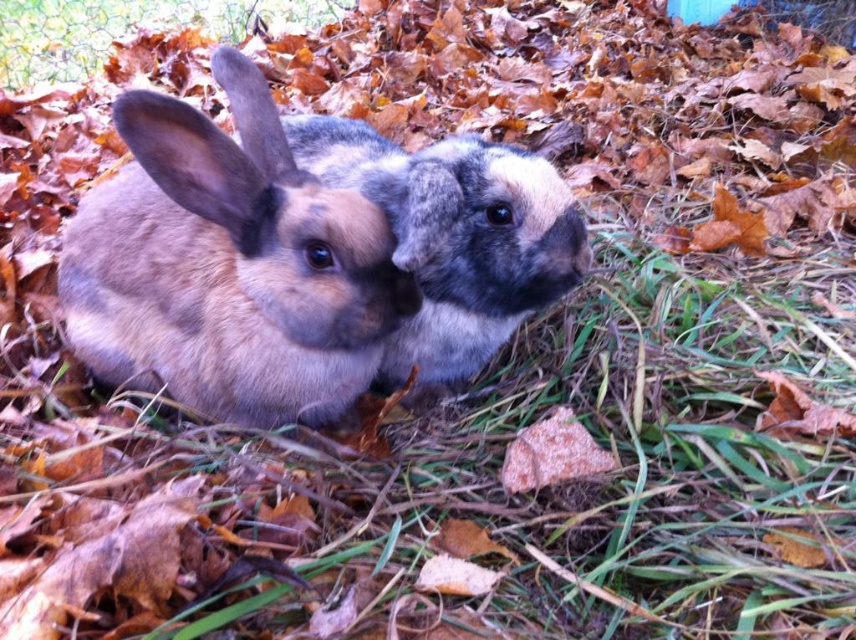
Question: Is fuzzy brown rabbit at left smaller than green grass at upper left?

Choices:
 (A) no
 (B) yes

Answer: (B)

Question: Is fuzzy brown rabbit at center positioned behind green grass at upper left?

Choices:
 (A) yes
 (B) no

Answer: (B)

Question: Based on their relative distances, which object is nearer to the fuzzy brown rabbit at center?

Choices:
 (A) green grass at upper left
 (B) fuzzy brown rabbit at left

Answer: (B)

Question: Among these objects, which one is farthest from the camera?

Choices:
 (A) green grass at upper left
 (B) fuzzy brown rabbit at center

Answer: (A)

Question: Which object appears farthest from the camera in this image?

Choices:
 (A) green grass at upper left
 (B) fuzzy brown rabbit at left
 (C) fuzzy brown rabbit at center

Answer: (A)

Question: Is fuzzy brown rabbit at center bigger than green grass at upper left?

Choices:
 (A) yes
 (B) no

Answer: (B)